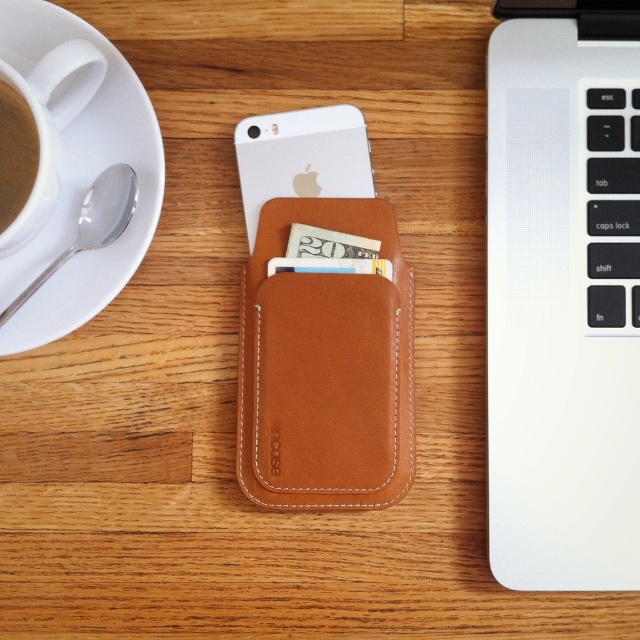
Question: Can you confirm if white matte laptop at upper right is smaller than white matte iphone at center?

Choices:
 (A) yes
 (B) no

Answer: (B)

Question: Does tan leather wallet at center have a greater width compared to white matte iphone at center?

Choices:
 (A) yes
 (B) no

Answer: (A)

Question: Which object appears farthest from the camera in this image?

Choices:
 (A) white matte laptop at upper right
 (B) white ceramic saucer at upper left
 (C) tan leather wallet at center
 (D) white matte iphone at center

Answer: (D)

Question: Among these objects, which one is nearest to the camera?

Choices:
 (A) tan leather wallet at center
 (B) brown matte cup of coffee at left

Answer: (B)

Question: Is white ceramic saucer at upper left wider than brown matte cup of coffee at left?

Choices:
 (A) no
 (B) yes

Answer: (B)

Question: Which object appears closest to the camera in this image?

Choices:
 (A) tan leather wallet at center
 (B) white ceramic saucer at upper left

Answer: (B)